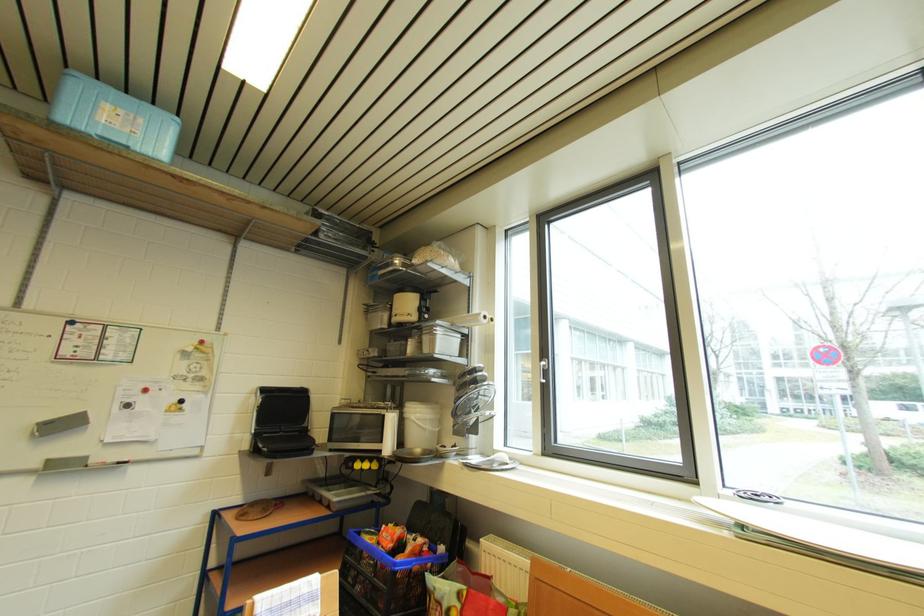
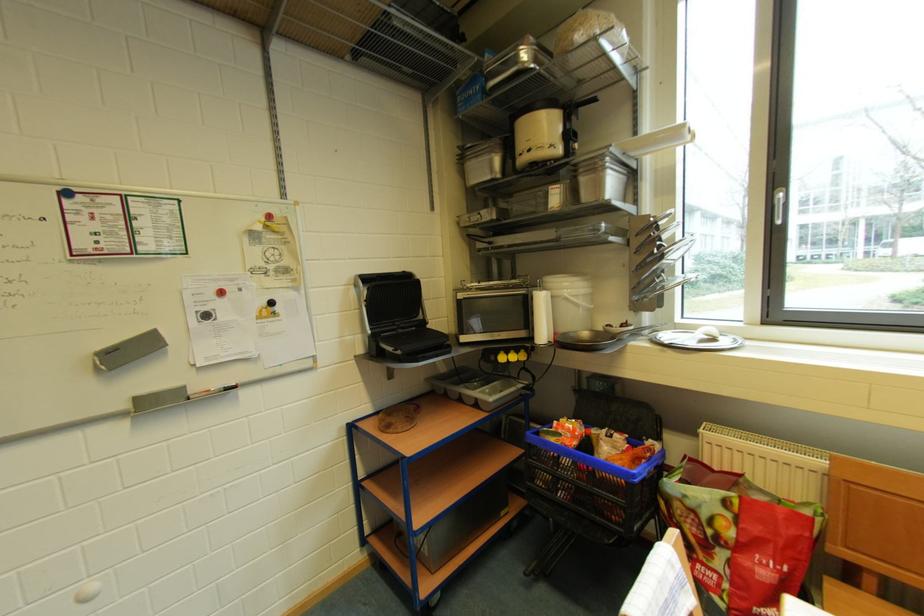
Find the pixel in the second image that matches (x=458, y=450) in the first image.

(629, 329)